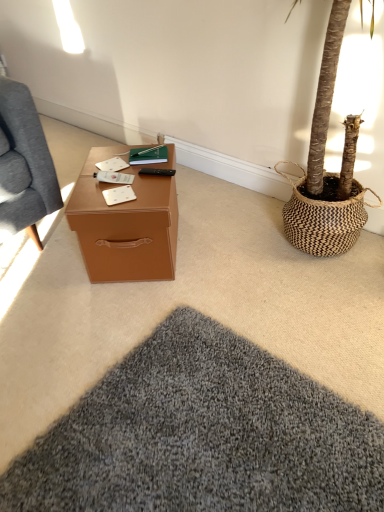
Question: Can you confirm if brown leather desk at center is wider than soft gray carpet at center?

Choices:
 (A) yes
 (B) no

Answer: (B)

Question: Does brown leather desk at center come in front of soft gray carpet at center?

Choices:
 (A) yes
 (B) no

Answer: (B)

Question: Is brown leather desk at center outside soft gray carpet at center?

Choices:
 (A) yes
 (B) no

Answer: (A)

Question: Is brown leather desk at center far away from soft gray carpet at center?

Choices:
 (A) yes
 (B) no

Answer: (B)

Question: Considering the relative sizes of brown leather desk at center and soft gray carpet at center in the image provided, is brown leather desk at center smaller than soft gray carpet at center?

Choices:
 (A) yes
 (B) no

Answer: (A)

Question: In terms of height, does hardcover book at center look taller or shorter compared to black matte remote control at center?

Choices:
 (A) tall
 (B) short

Answer: (A)

Question: From the image's perspective, relative to black matte remote control at center, is hardcover book at center above or below?

Choices:
 (A) below
 (B) above

Answer: (B)

Question: Is hardcover book at center wider or thinner than black matte remote control at center?

Choices:
 (A) thin
 (B) wide

Answer: (B)

Question: Based on their sizes in the image, would you say hardcover book at center is bigger or smaller than black matte remote control at center?

Choices:
 (A) big
 (B) small

Answer: (A)

Question: Is white matte notepad at center inside the boundaries of black matte remote control at center, or outside?

Choices:
 (A) inside
 (B) outside

Answer: (B)

Question: Looking at the image, does white matte notepad at center seem bigger or smaller compared to black matte remote control at center?

Choices:
 (A) small
 (B) big

Answer: (A)

Question: From the image's perspective, relative to black matte remote control at center, is white matte notepad at center above or below?

Choices:
 (A) below
 (B) above

Answer: (A)

Question: From their relative heights in the image, would you say white matte notepad at center is taller or shorter than black matte remote control at center?

Choices:
 (A) tall
 (B) short

Answer: (B)

Question: Is point (145, 237) closer or farther from the camera than point (162, 432)?

Choices:
 (A) farther
 (B) closer

Answer: (A)

Question: Based on their positions, is brown leather desk at center located to the left or right of soft gray carpet at center?

Choices:
 (A) right
 (B) left

Answer: (A)